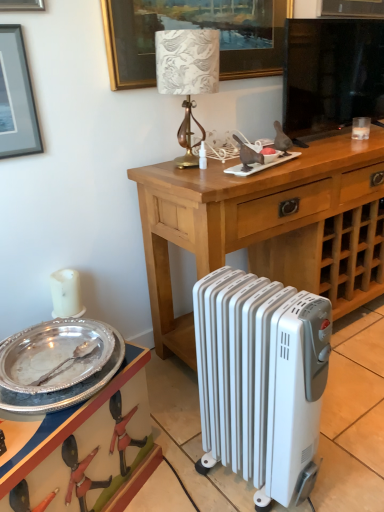
Question: In the image, is black glass television at upper center positioned in front of or behind gold metallic lampshade at center?

Choices:
 (A) behind
 (B) front

Answer: (A)

Question: Based on their positions, is black glass television at upper center located to the left or right of gold metallic lampshade at center?

Choices:
 (A) right
 (B) left

Answer: (A)

Question: Which object is positioned closest to the black glass television at upper center?

Choices:
 (A) silver metallic tray at lower left
 (B) white metallic radiator at lower center
 (C) matte black picture frame at upper left, which is the second picture frame in back-to-front order
 (D) silver/golden picture frame at upper center, which is the first picture frame from top to bottom
 (E) silver/glossy plate at lower left

Answer: (D)

Question: Estimate the real-world distances between objects in this image. Which object is farther from the gold metallic lampshade at center?

Choices:
 (A) silver/golden picture frame at upper center, which appears as the 1th picture frame when viewed from the back
 (B) white metallic radiator at lower center
 (C) wooden desk at center
 (D) silver metallic tray at lower left
 (E) matte black picture frame at upper left, the second picture frame viewed from the right

Answer: (D)